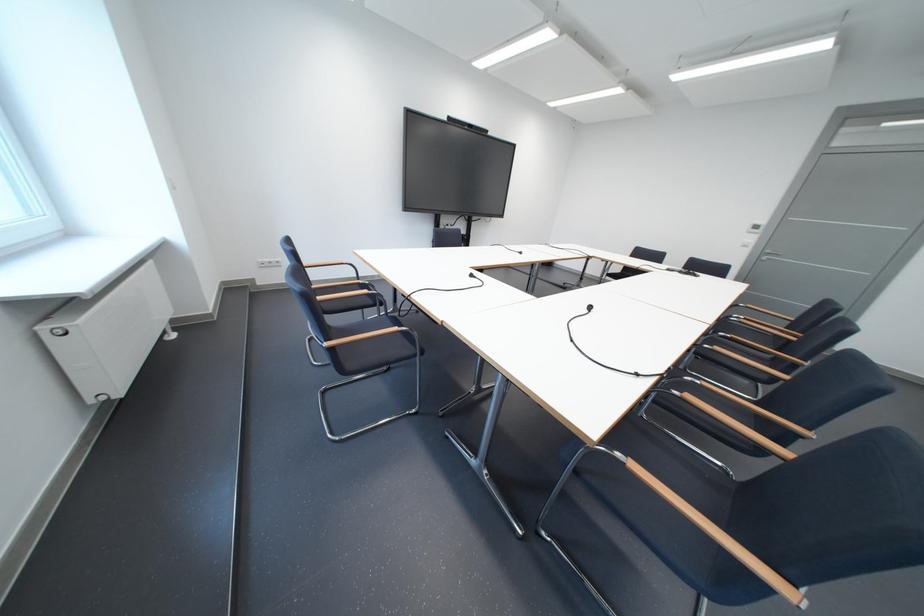
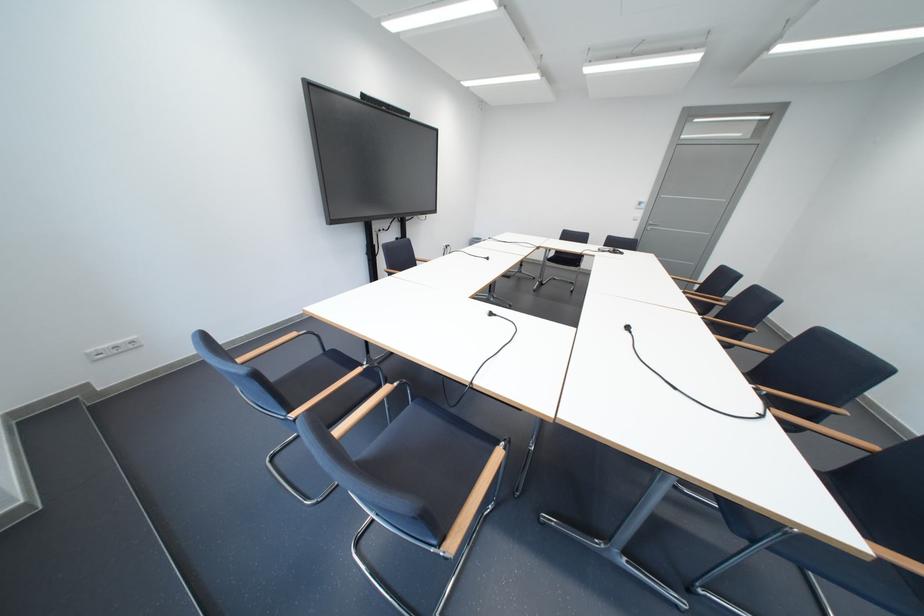
What movement of the cameraman would produce the second image?

The cameraman moved toward left, forward.